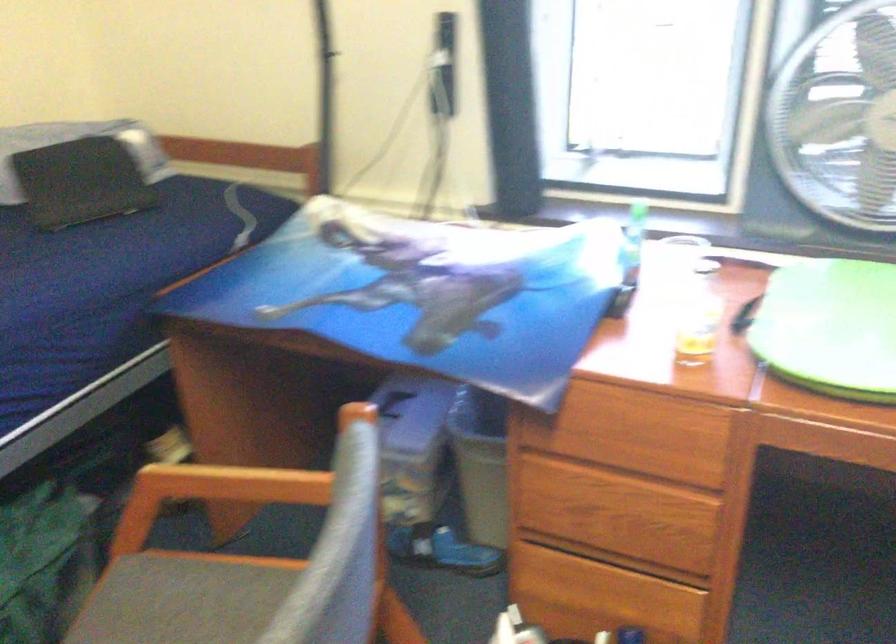
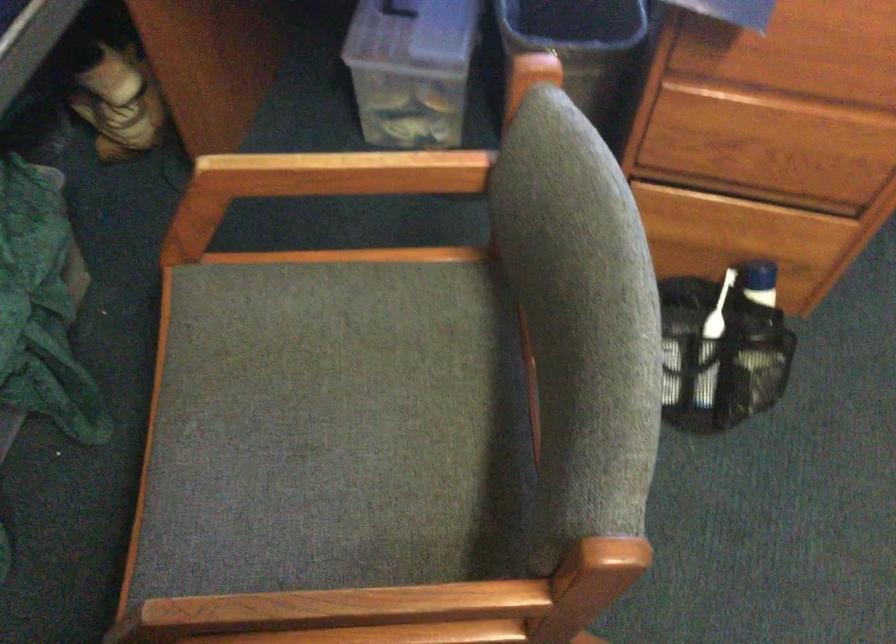
Question: Based on the continuous images, in which direction is the camera rotating? Reply with the corresponding letter.

Choices:
 (A) Left
 (B) Right
 (C) Up
 (D) Down

Answer: (D)